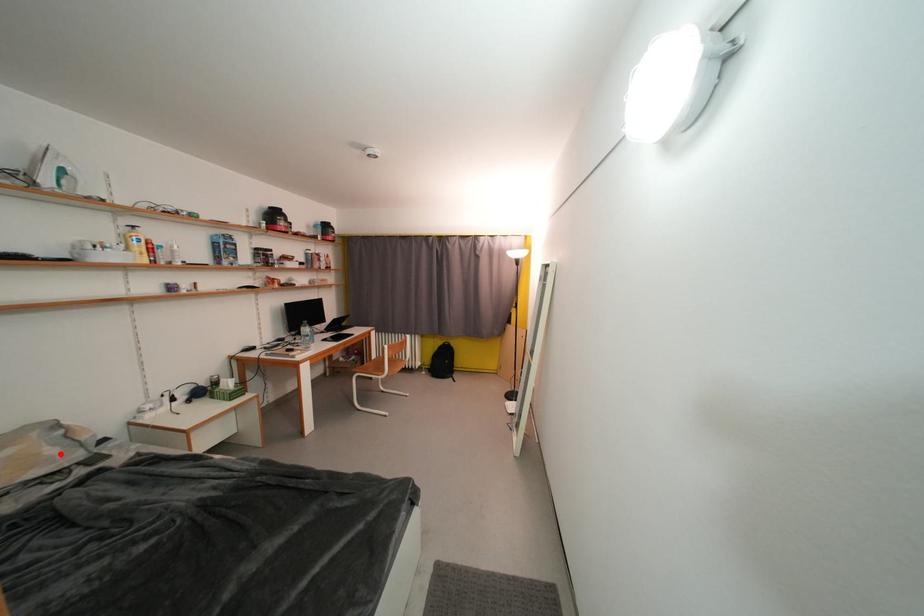
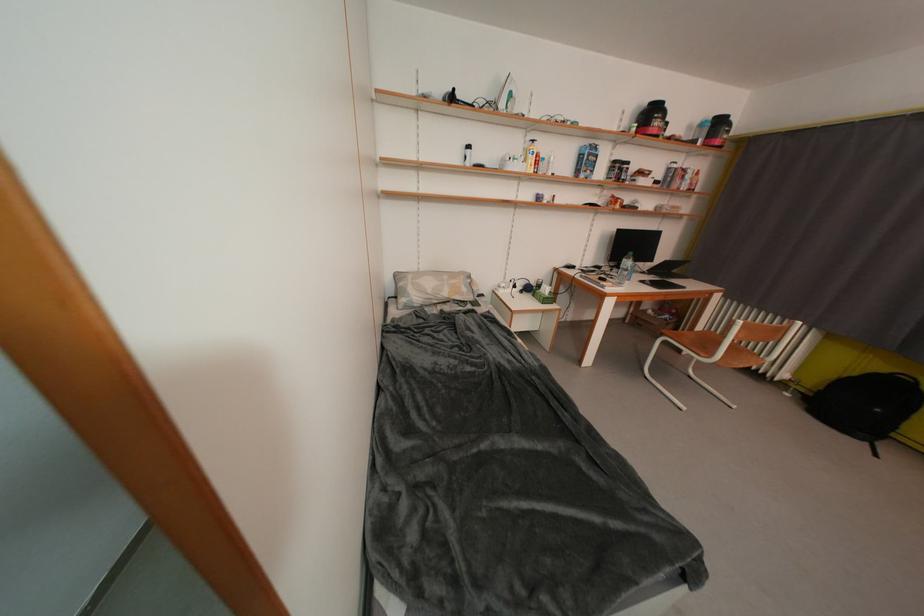
Where in the second image is the point corresponding to the highlighted location from the first image?

(471, 293)